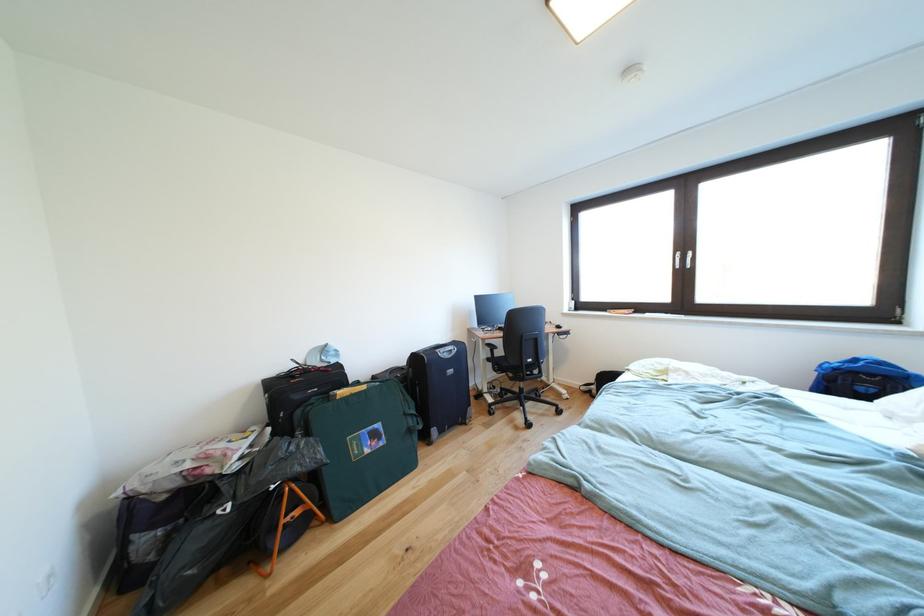
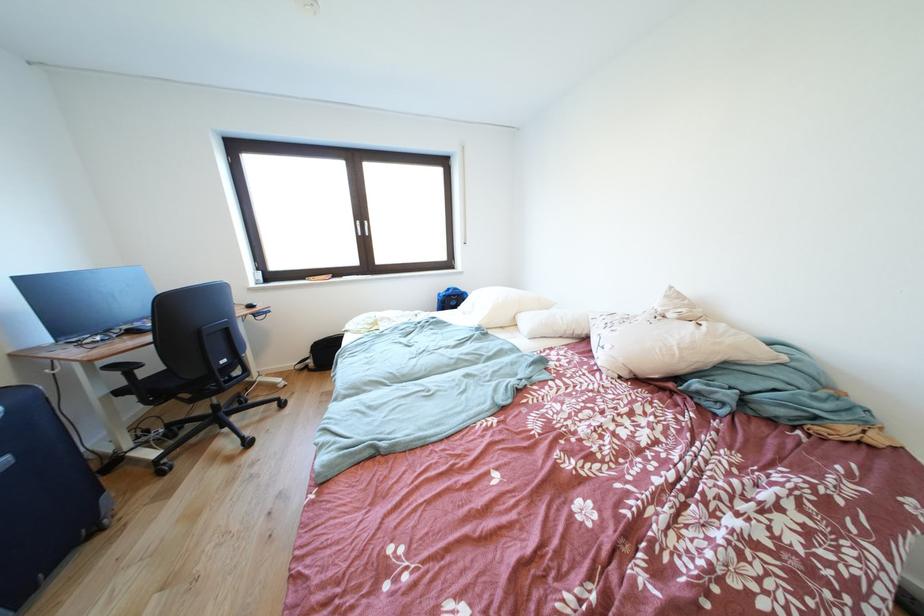
Find the pixel in the second image that matches pixel 458 376 in the first image.

(8, 468)